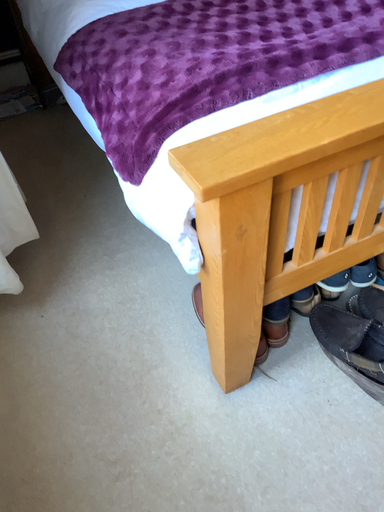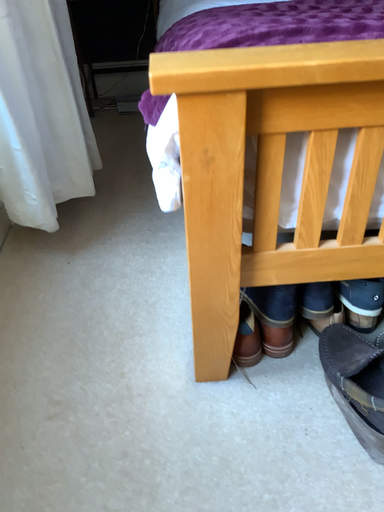
Question: Which way did the camera rotate in the video?

Choices:
 (A) rotated upward
 (B) rotated downward

Answer: (A)